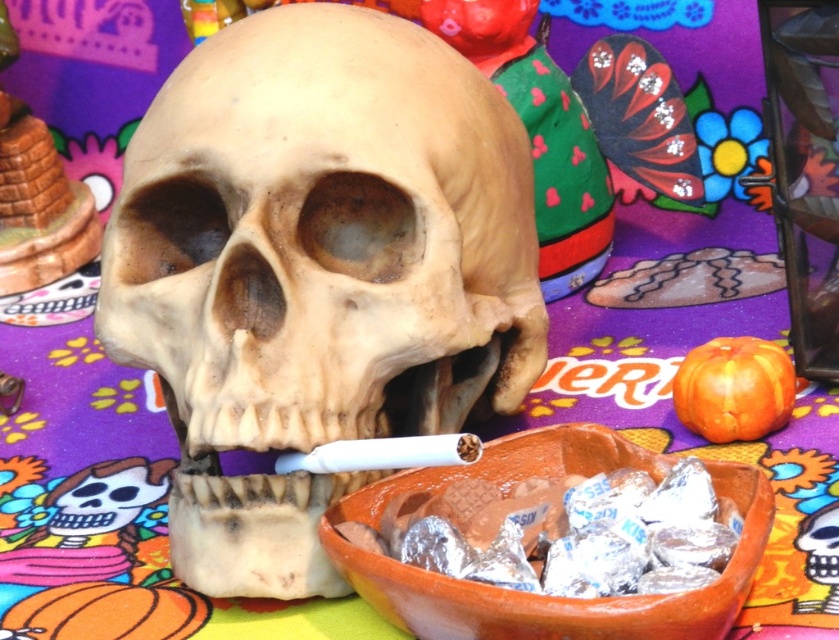
Does smooth beige skull at center appear on the right side of orange clay bowl at center?

No, smooth beige skull at center is not to the right of orange clay bowl at center.

Does smooth beige skull at center appear over orange clay bowl at center?

Indeed, smooth beige skull at center is positioned over orange clay bowl at center.

Image resolution: width=839 pixels, height=640 pixels. What are the coordinates of `smooth beige skull at center` in the screenshot? It's located at (316, 269).